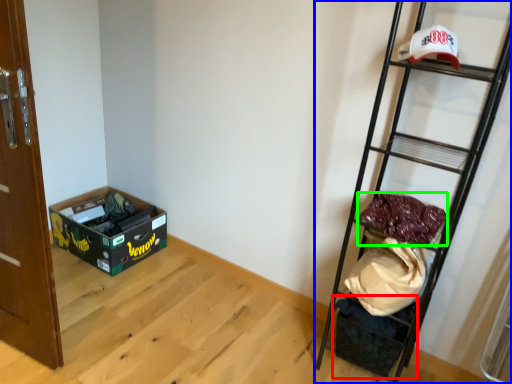
Question: Estimate the real-world distances between objects in this image. Which object is farther from storage box (highlighted by a red box), ladder (highlighted by a blue box) or material (highlighted by a green box)?

Choices:
 (A) ladder
 (B) material

Answer: (B)